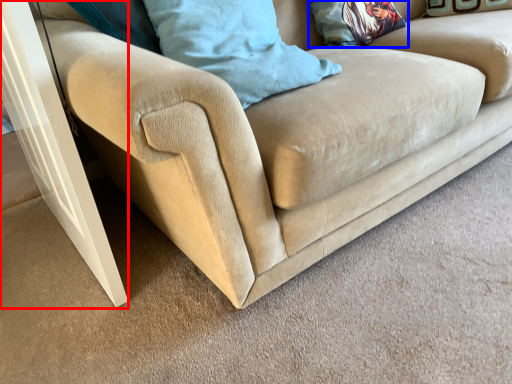
Question: Which point is closer to the camera, screen door (highlighted by a red box) or pillow (highlighted by a blue box)?

Choices:
 (A) screen door
 (B) pillow

Answer: (A)